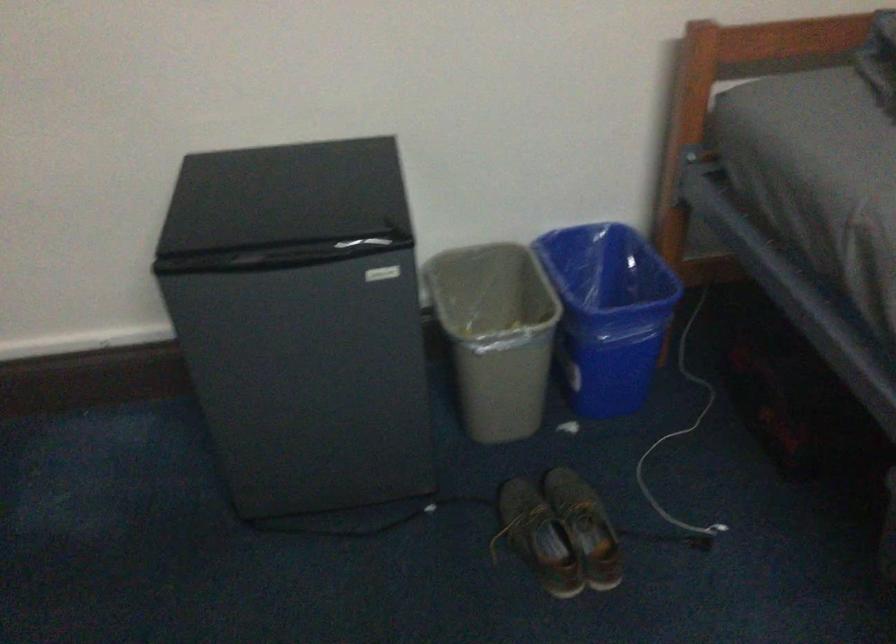
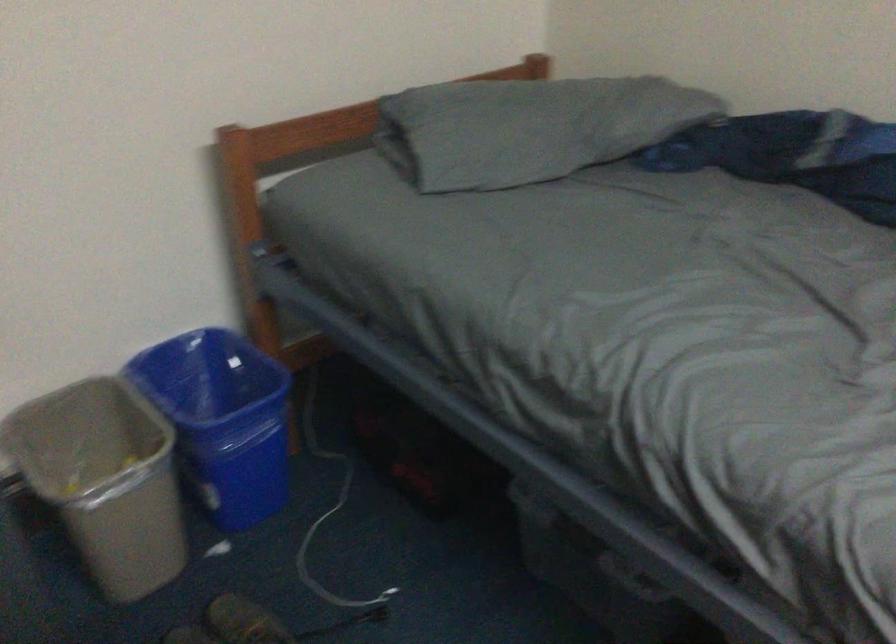
Locate, in the second image, the point that corresponds to the point at 492,333 in the first image.

(104, 480)